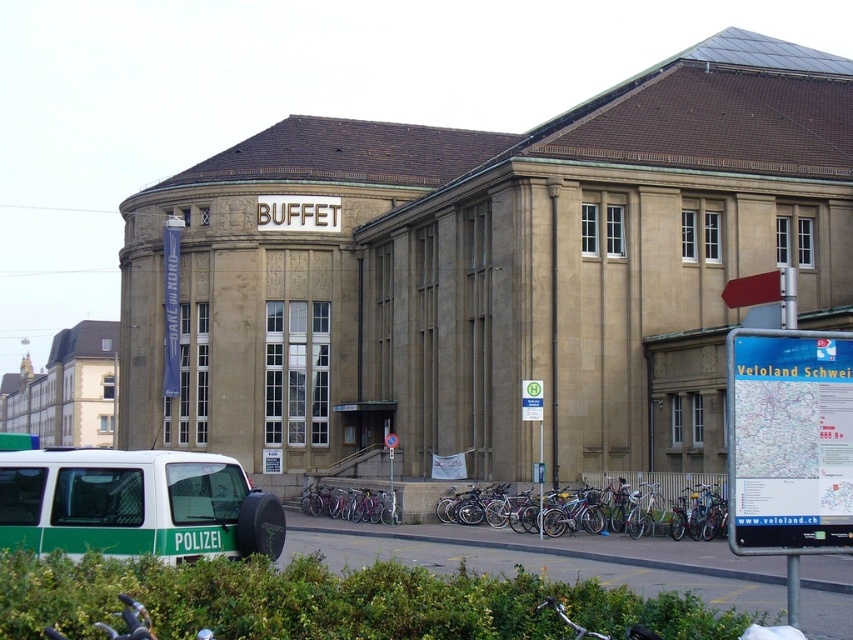
You are standing in front of the beige stone building with the BUFFET sign. You see two bicycles parked in front of the building. Which bicycle is positioned higher? The silver metallic bicycle at center or the purple metallic bicycle at center?

The silver metallic bicycle at center is positioned higher than the purple metallic bicycle at center according to the description.

From the picture: Please write a question that asks whether the green leafy bush at lower center is located closer to the front of the image or the back, using its coordinates. The question must not mention coordinates or the term 2D location. The answer should use the coordinates to determine the position, stating that lower Y values are closer to the front.

The green leafy bush at lower center is located closer to the front of the image because its Y coordinate is 0.393, which is lower than the middle of the image. In this coordinate system, lower Y values indicate positions closer to the front.